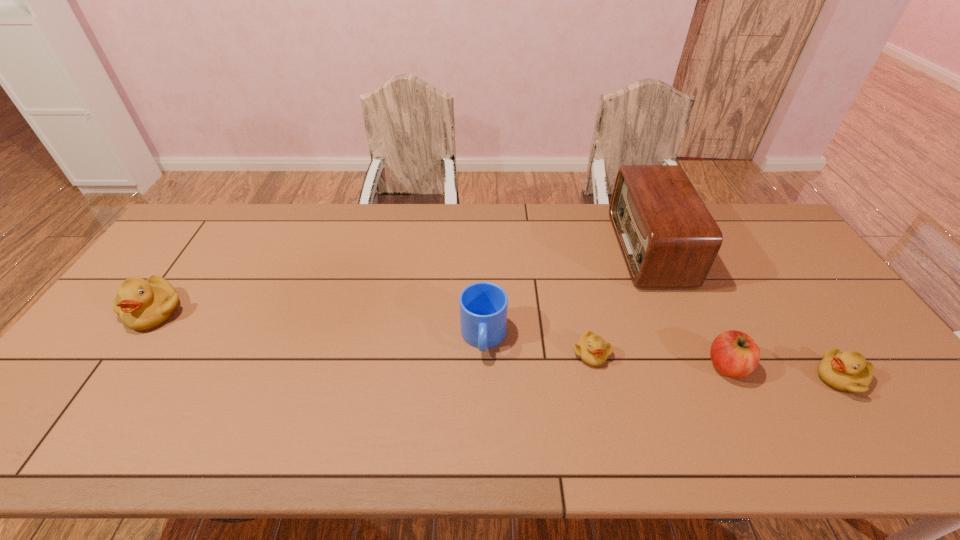
Locate an element on the screen. The height and width of the screenshot is (540, 960). free location located at the beak of the fifth tallest object is located at coordinates (752, 378).

Where is `vacant space located at the beak of the fifth tallest object`? The image size is (960, 540). vacant space located at the beak of the fifth tallest object is located at coordinates (772, 378).

Identify the location of blank space located at the beak of the fifth tallest object. tap(792, 378).

The image size is (960, 540). Identify the location of free point located 0.300m on the front panel of the radio receiver. (528, 249).

The height and width of the screenshot is (540, 960). Find the location of `vacant space positioned on the front panel of the radio receiver`. vacant space positioned on the front panel of the radio receiver is located at coordinates (546, 249).

You are a GUI agent. You are given a task and a screenshot of the screen. Output one action in this format:
    pyautogui.click(x=<x>, y=<y>)
    Task: Click on the free space located on the front panel of the radio receiver
    The height and width of the screenshot is (540, 960).
    Given the screenshot: What is the action you would take?
    pyautogui.click(x=535, y=249)

Locate an element on the screen. vacant area located 0.120m on the side of the mug with the handle is located at coordinates (484, 406).

Where is `vacant area located on the right of the apple`? The width and height of the screenshot is (960, 540). vacant area located on the right of the apple is located at coordinates (854, 366).

I want to click on object present at the far edge, so click(668, 238).

Image resolution: width=960 pixels, height=540 pixels. In order to click on duckling positioned at the near edge in this screenshot , I will do `click(848, 371)`.